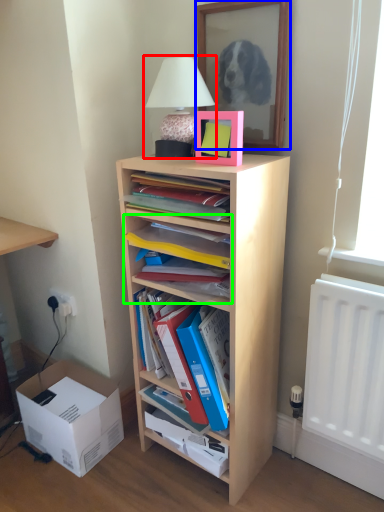
Question: Which object is positioned closest to table lamp (highlighted by a red box)? Select from mirror (highlighted by a blue box) and shelf (highlighted by a green box).

Choices:
 (A) mirror
 (B) shelf

Answer: (A)